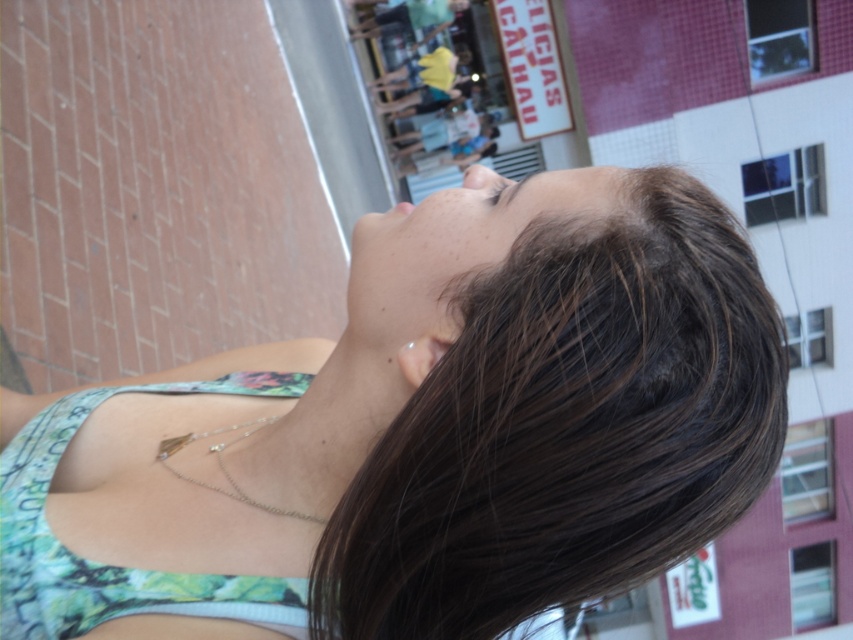
You are an artist sketching the woman in the scene. You need to decide which object to focus on first based on their sizes. Which one should you draw first, the green floral tank top at center or the brown matte eye at upper center?

The green floral tank top at center has a larger size compared to the brown matte eye at upper center, so you should draw the green floral tank top at center first since it is bigger and likely more prominent in the composition.

Based on the scene description, which object is positioned higher on the face between the smooth skin face at center and the matte skin nose at center?

The matte skin nose at center is positioned higher on the face compared to the smooth skin face at center.

You are a photographer trying to capture the perfect shot of the woman in the scene. You want to ensure that the green floral fabric bikini top at center and the matte skin nose at center are both visible in your photo. Based on their positions, which object should appear closer to the left side of the photo?

The green floral fabric bikini top at center appears to the left of the matte skin nose at center, so it will be closer to the left side of the photo.